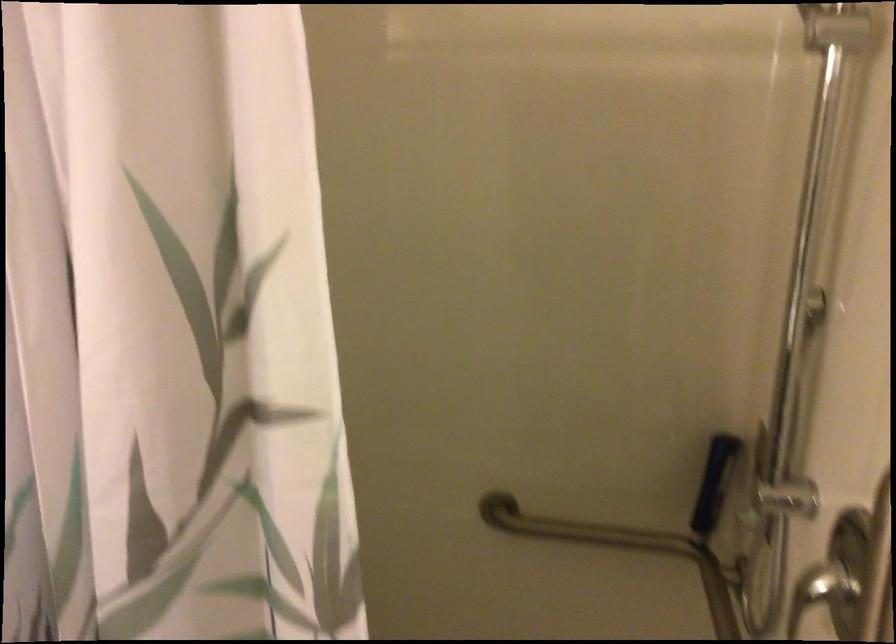
At what (x,y) coordinates should I click in order to perform the action: click on metal grab bar. Please return your answer as a coordinate pair (x, y). The width and height of the screenshot is (896, 644). Looking at the image, I should click on (622, 549).